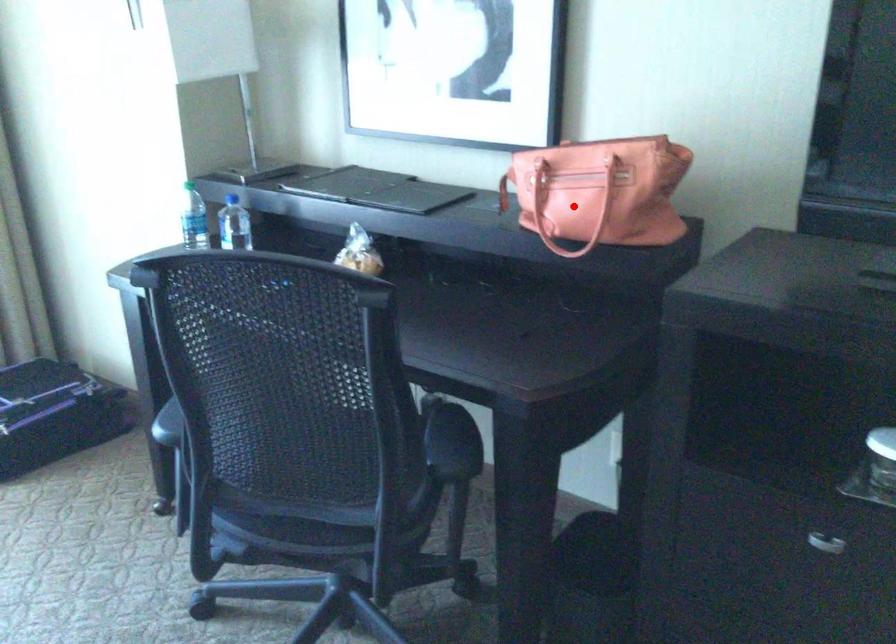
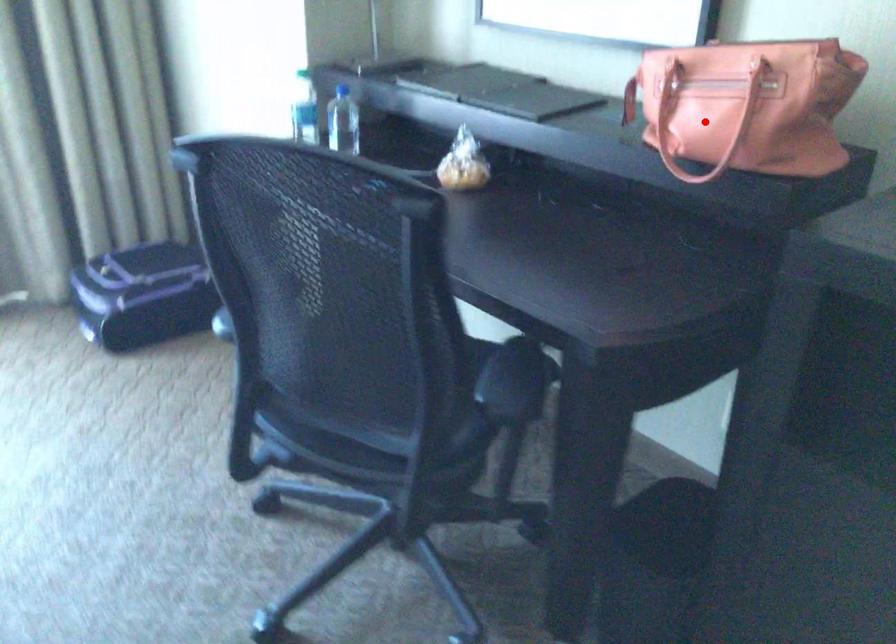
I am providing you with two images of the same scene from different viewpoints. A red point is marked on the first image and another point is marked on the second image. Is the red point in image1 aligned with the point shown in image2?

Yes